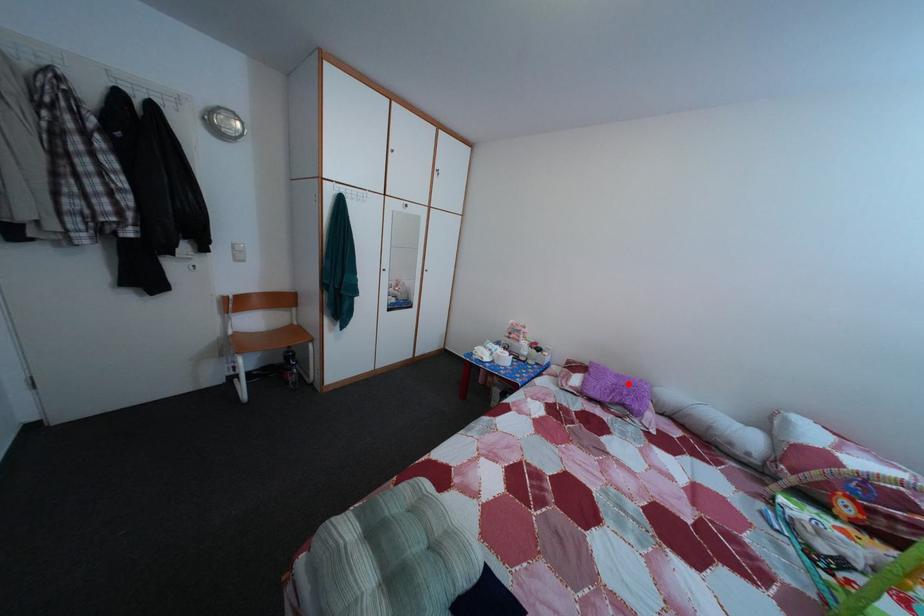
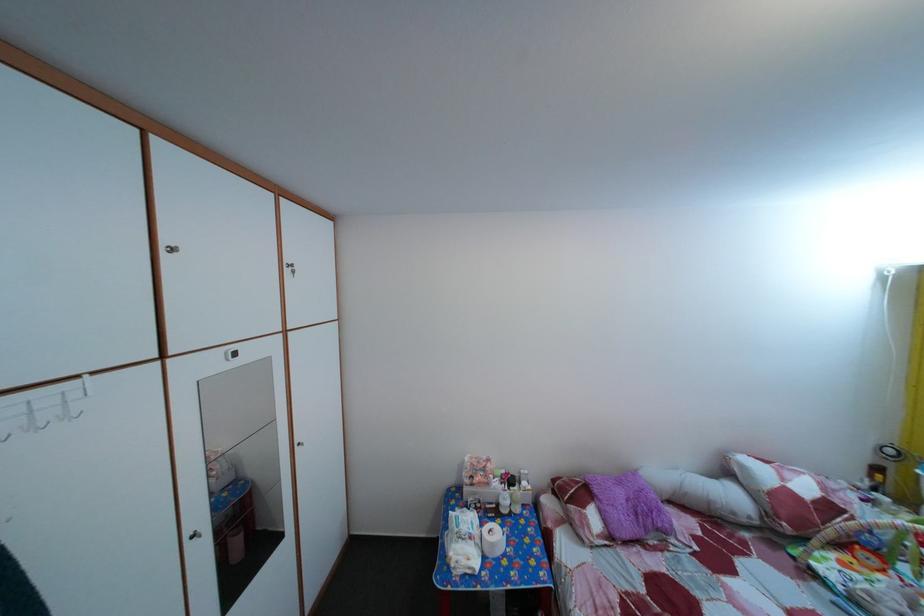
Locate, in the second image, the point that corresponds to the highlighted location in the first image.

(629, 491)